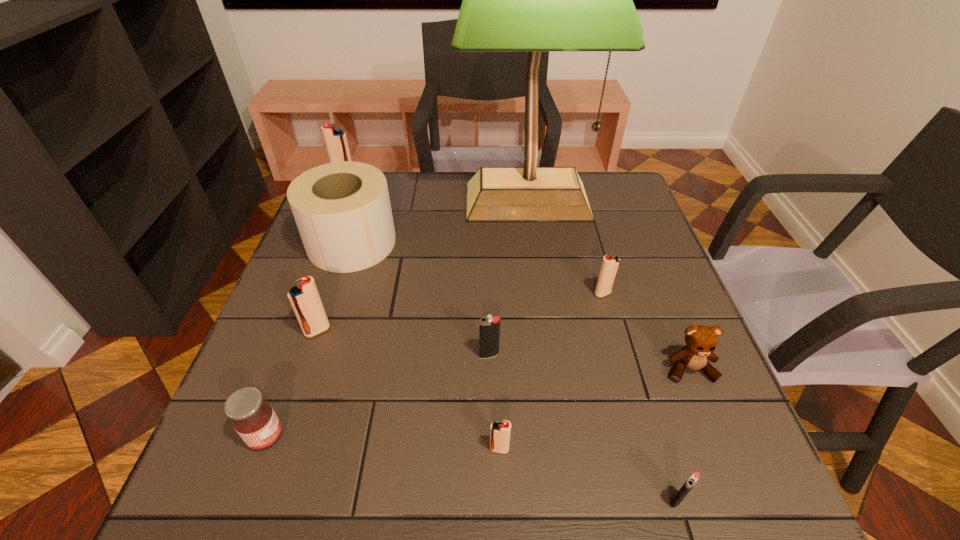
The image size is (960, 540). Find the location of `free spot located 0.340m on the front of the toilet tissue`. free spot located 0.340m on the front of the toilet tissue is located at coordinates (302, 395).

Locate an element on the screen. The height and width of the screenshot is (540, 960). free space located on the front of the fourth nearest igniter is located at coordinates (302, 375).

Locate an element on the screen. free spot located 0.400m on the left of the fourth farthest igniter is located at coordinates (285, 355).

Where is `vacant space located 0.200m on the back of the rightmost red igniter`? Image resolution: width=960 pixels, height=540 pixels. vacant space located 0.200m on the back of the rightmost red igniter is located at coordinates (587, 235).

Find the location of a particular element. This screenshot has height=540, width=960. free spot located on the label side of the jam is located at coordinates (318, 436).

Locate an element on the screen. vacant space located 0.100m on the front-facing side of the rightmost object is located at coordinates (715, 433).

Locate an element on the screen. This screenshot has height=540, width=960. vacant space located 0.110m on the back of the fifth farthest igniter is located at coordinates (497, 388).

Locate an element on the screen. This screenshot has width=960, height=540. vacant region located 0.350m on the left of the nearest object is located at coordinates (450, 501).

Find the location of a particular element. Image resolution: width=960 pixels, height=540 pixels. table lamp located in the far edge section of the desktop is located at coordinates coord(534,0).

The height and width of the screenshot is (540, 960). Identify the location of igniter situated at the far edge. (336, 143).